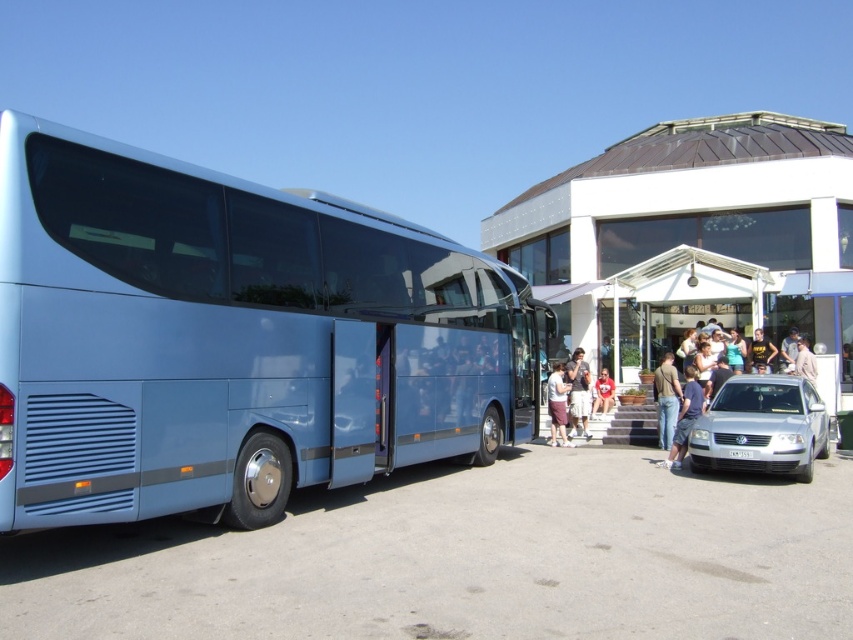
You are standing at the entrance of the building and want to walk to the bus doors. You see two points marked on the ground ahead of you. The first point is at point (676, 371) and the second point is at point (608, 384). Which point should you step on first to reach the bus doors without crossing in front of the silver car parked nearby?

You should step on point (676, 371) first because it is in front of point (608, 384), so stepping on it first will keep you closer to the bus and avoid crossing in front of the silver car.

From the picture: You are standing at the entrance of the building and see a point marked at coordinates (578, 392). What object is located at that point?

The point at coordinates (578, 392) marks the light blue fabric shirt at center.